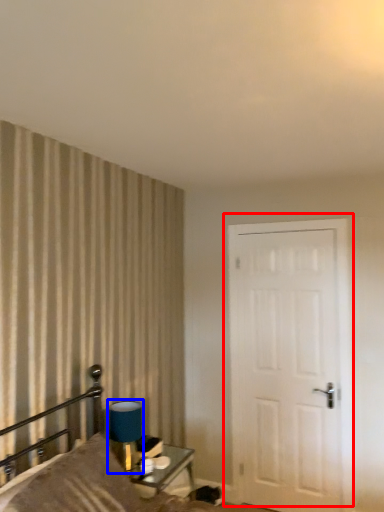
Question: Which of the following is the farthest to the observer, door (highlighted by a red box) or table lamp (highlighted by a blue box)?

Choices:
 (A) door
 (B) table lamp

Answer: (A)